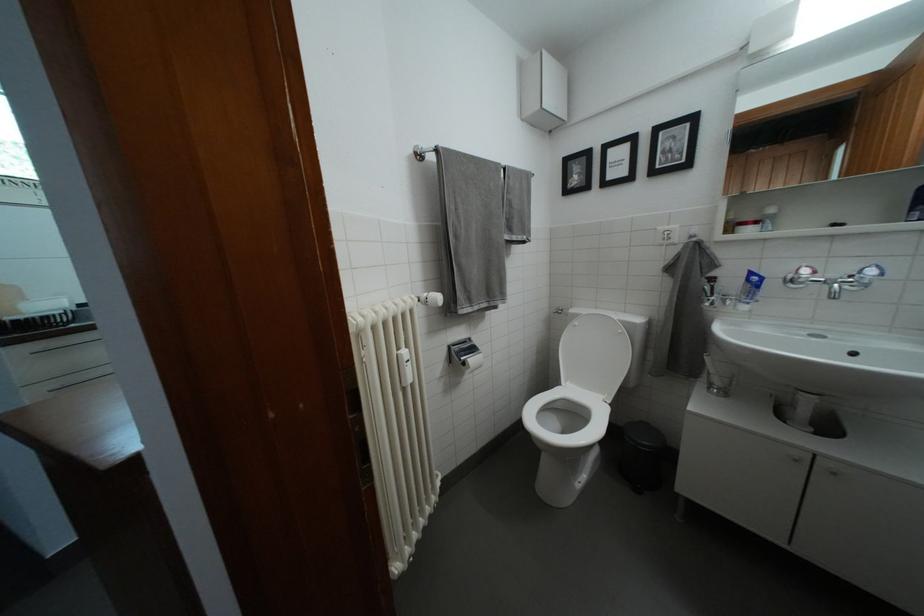
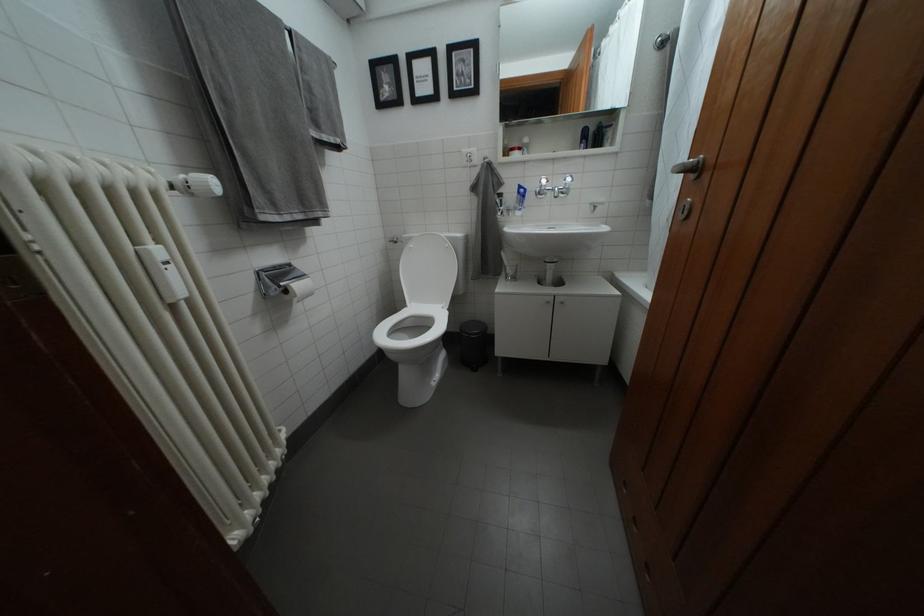
Question: The images are taken continuously from a first-person perspective. In which direction is your viewpoint rotating?

Choices:
 (A) Left
 (B) Right
 (C) Up
 (D) Down

Answer: (B)